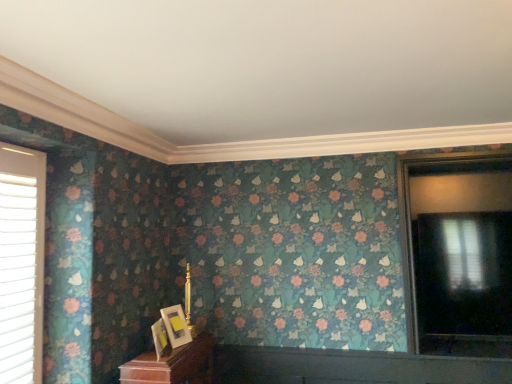
Question: In terms of height, does matte gold picture frame at lower center, which is the 1th picture frame from back to front, look taller or shorter compared to matte black window at right, the second window viewed from the left?

Choices:
 (A) short
 (B) tall

Answer: (A)

Question: Is matte gold picture frame at lower center, the 2th picture frame in the front-to-back sequence, inside the boundaries of matte black window at right, which ranks as the first window in right-to-left order, or outside?

Choices:
 (A) inside
 (B) outside

Answer: (B)

Question: Estimate the real-world distances between objects in this image. Which object is farther from the matte black window at right, the second window viewed from the left?

Choices:
 (A) white plastic blinds at left, the 1th window positioned from the left
 (B) matte gold picture frame at lower center, which is the 1th picture frame in front-to-back order
 (C) matte gold picture frame at lower center, the 2th picture frame in the front-to-back sequence

Answer: (A)

Question: Based on their relative distances, which object is nearer to the matte gold picture frame at lower center, the 2th picture frame in the front-to-back sequence?

Choices:
 (A) white plastic blinds at left, the 1th window positioned from the left
 (B) matte gold picture frame at lower center, the 2th picture frame viewed from the back
 (C) matte black window at right, the second window viewed from the left

Answer: (B)